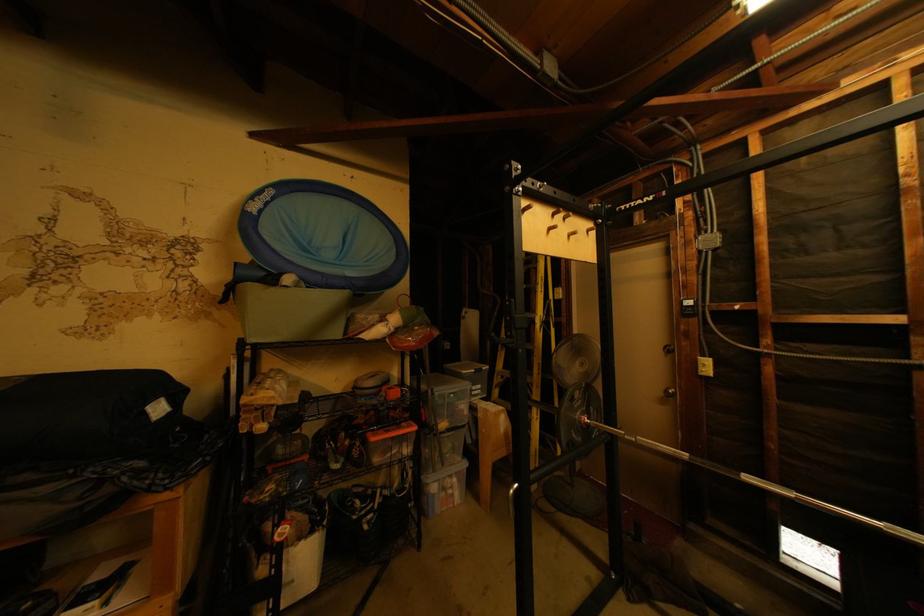
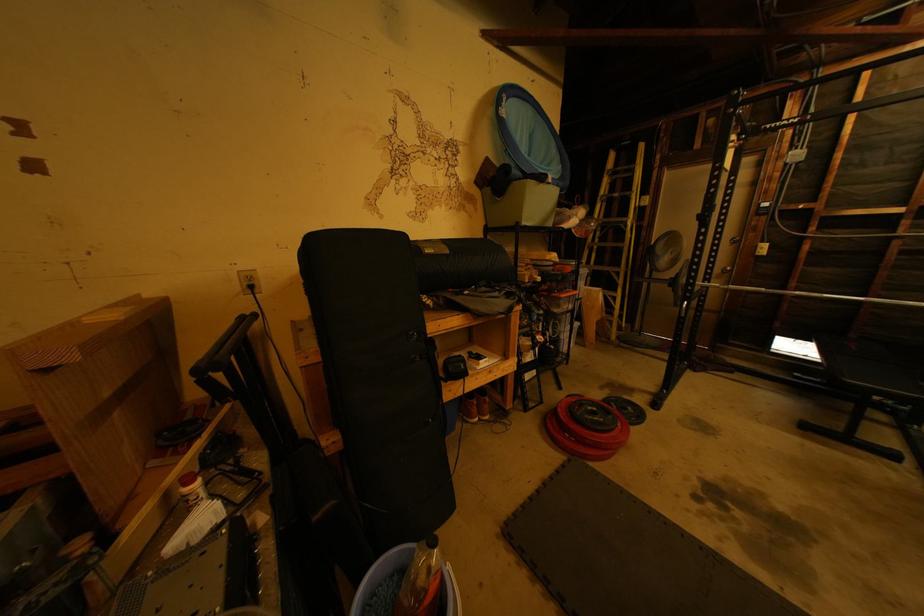
The images are taken continuously from a first-person perspective. In which direction are you moving?

The movement direction of the cameraman is left, backward.